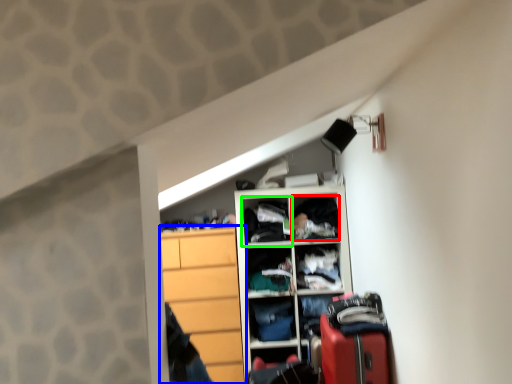
Question: Based on their relative distances, which object is nearer to clothing (highlighted by a red box)? Choose from cabinetry (highlighted by a blue box) and cabinet (highlighted by a green box).

Choices:
 (A) cabinetry
 (B) cabinet

Answer: (B)